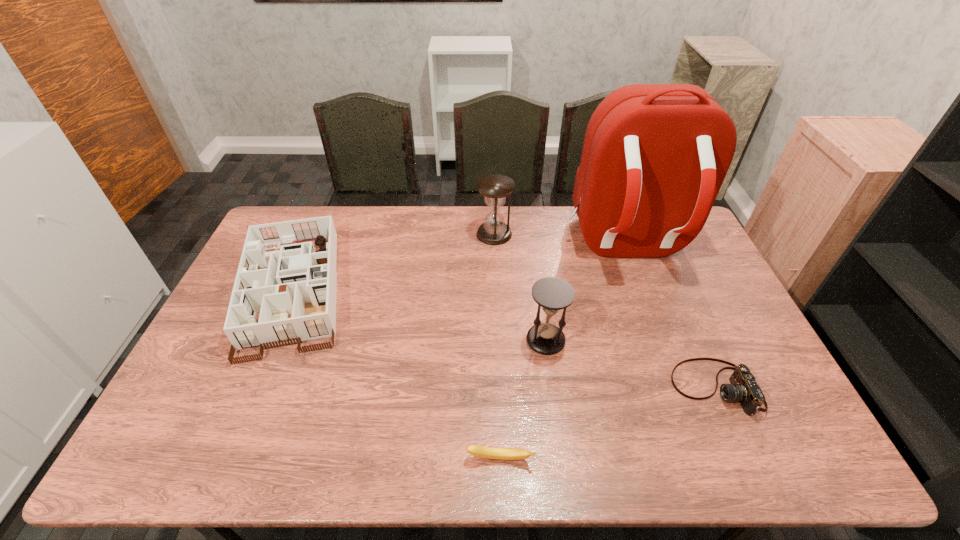
Locate an element on the screen. backpack is located at coordinates (654, 158).

Find the location of a particular element. the left hourglass is located at coordinates (495, 188).

Find the location of a particular element. Image resolution: width=960 pixels, height=540 pixels. the nearer hourglass is located at coordinates (552, 294).

The image size is (960, 540). I want to click on the third object from right to left, so click(x=552, y=294).

This screenshot has width=960, height=540. Identify the location of dollhouse. (294, 289).

Locate an element on the screen. the fourth tallest object is located at coordinates (294, 289).

You are a GUI agent. You are given a task and a screenshot of the screen. Output one action in this format:
    pyautogui.click(x=<x>, y=<y>)
    Task: Click on the camera
    
    Given the screenshot: What is the action you would take?
    pyautogui.click(x=743, y=388)

This screenshot has height=540, width=960. Identify the location of the nearest object. pos(479,451).

Where is `vacant point located on the strap side of the backpack`? The width and height of the screenshot is (960, 540). vacant point located on the strap side of the backpack is located at coordinates (673, 375).

This screenshot has width=960, height=540. In order to click on free location located on the right of the farther hourglass in this screenshot , I will do `click(544, 234)`.